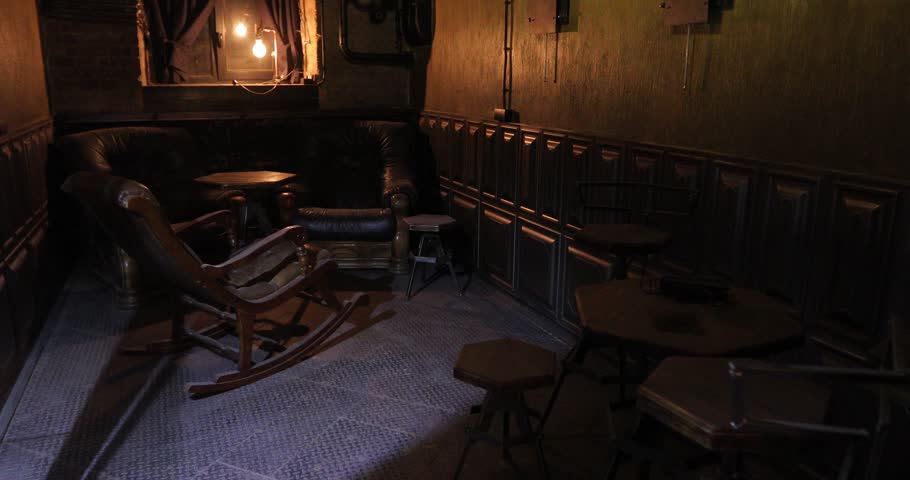
The height and width of the screenshot is (480, 910). I want to click on table, so click(x=633, y=320).